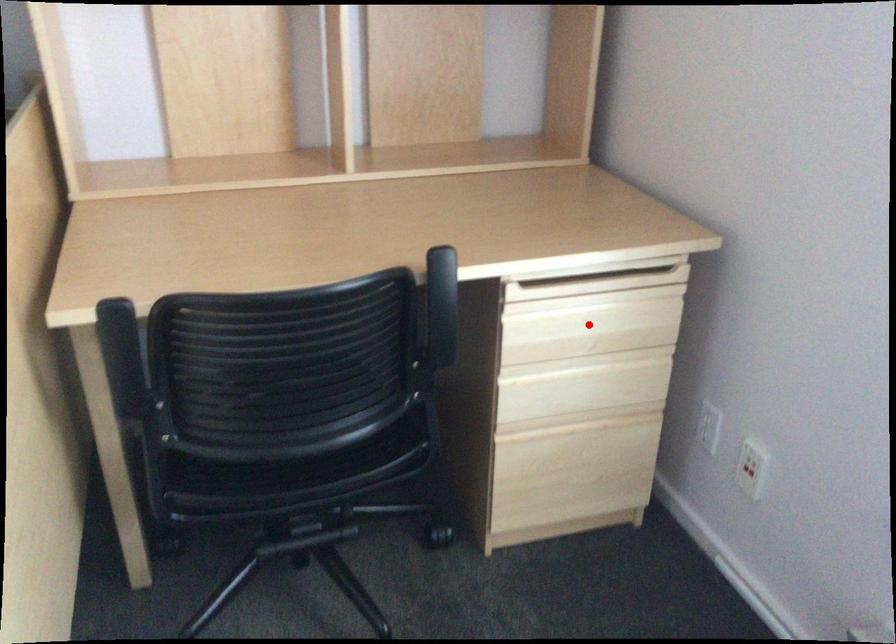
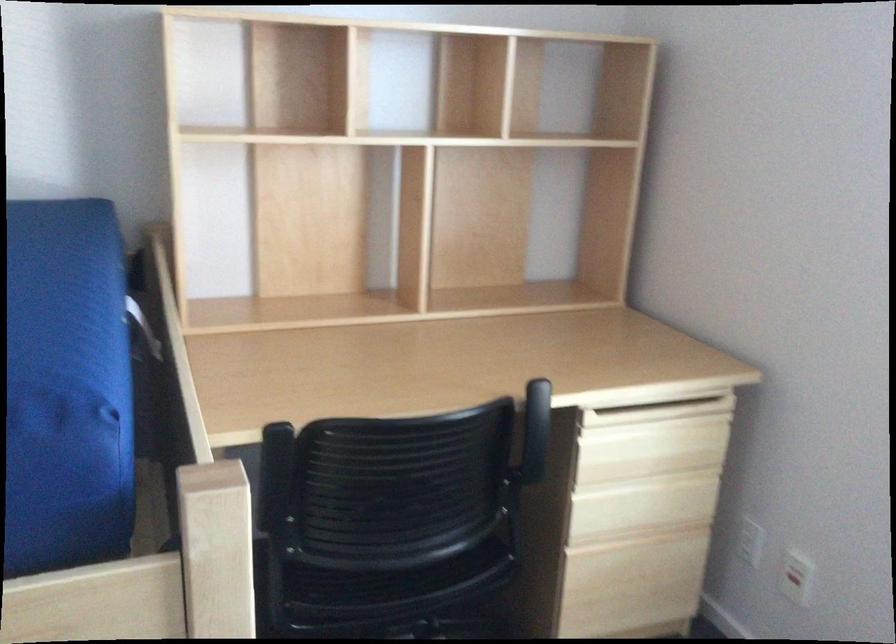
Question: I am providing you with two images of the same scene from different viewpoints. Image1 has a red point marked. In image2, the corresponding 3D location appears at what relative position? Reply with the corresponding letter.

Choices:
 (A) Closer
 (B) Farther

Answer: (B)